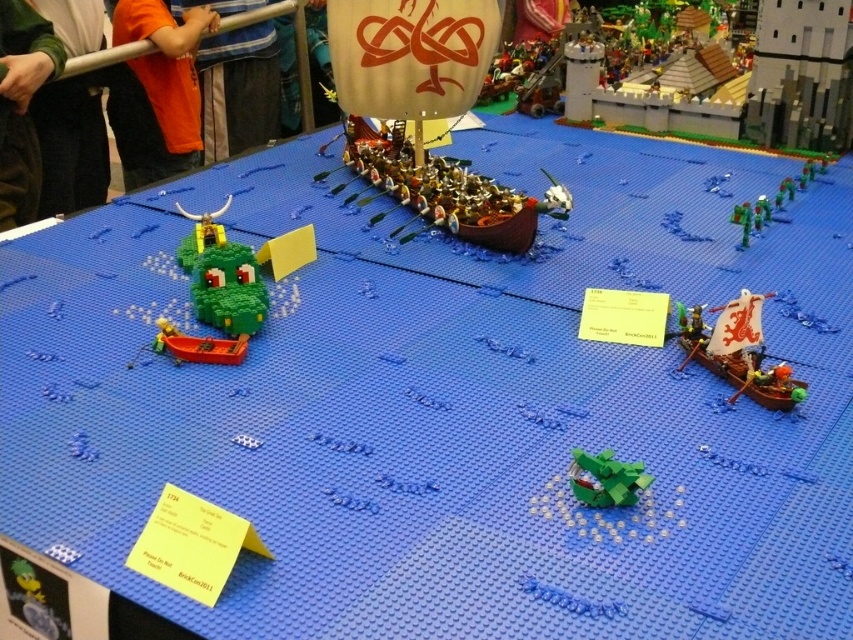
You are a Lego minifigure standing at the center of the Viking ship in the diorama. You need to locate the orange shirt at upper left. Which direction should you look to see it?

The orange shirt at upper left is located at point (238, 90), so you should look to your left and upwards to see it.

You are a Lego minifigure trying to spot the orange shirt at upper left from the green matte dragon at lower center. Considering their heights, which one would have a better vantage point to see over the surrounding ships?

The orange shirt at upper left is taller than the green matte dragon at lower center, so the orange shirt at upper left would have a better vantage point to see over the surrounding ships.